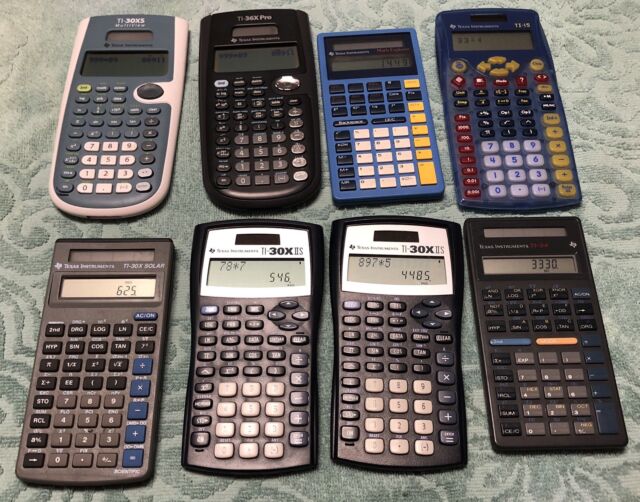
I want to click on screen, so click(406, 266), click(540, 262), click(491, 43), click(364, 62), click(257, 60), click(256, 271), click(107, 283), click(123, 69).